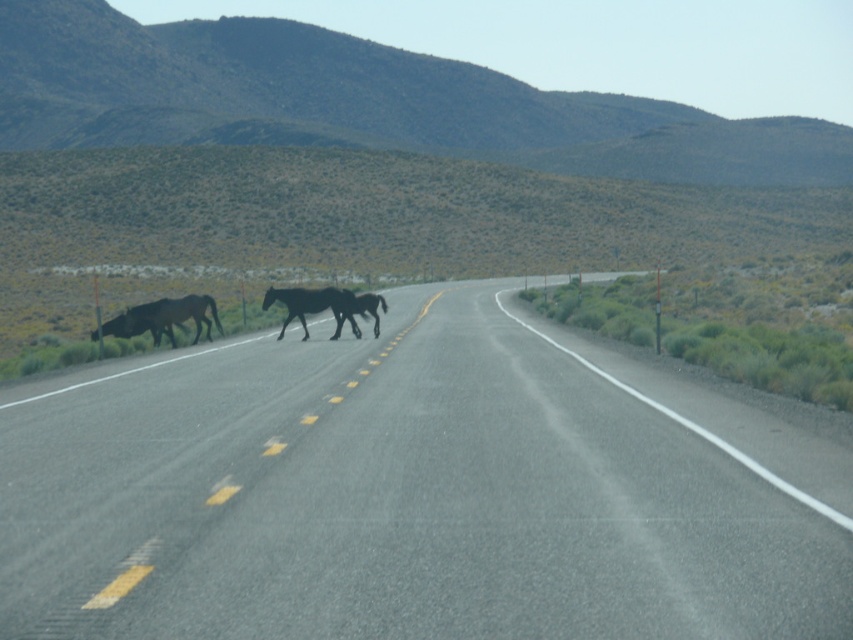
What do you see at coordinates (415, 492) in the screenshot? The image size is (853, 640). I see `black asphalt highway at center` at bounding box center [415, 492].

Between black asphalt highway at center and dark brown horse at center, which one has less height?

dark brown horse at center is shorter.

The image size is (853, 640). Describe the element at coordinates (415, 492) in the screenshot. I see `black asphalt highway at center` at that location.

You are a GUI agent. You are given a task and a screenshot of the screen. Output one action in this format:
    pyautogui.click(x=<x>, y=<y>)
    Task: Click on the black asphalt highway at center
    
    Given the screenshot: What is the action you would take?
    pyautogui.click(x=415, y=492)

Does point (312, 298) come in front of point (372, 305)?

Yes, point (312, 298) is closer to viewer.

Between black glossy horse at center and dark brown glossy horse at center, which one has more height?

Standing taller between the two is black glossy horse at center.

Does point (316, 296) come behind point (331, 339)?

That is False.

You are a GUI agent. You are given a task and a screenshot of the screen. Output one action in this format:
    pyautogui.click(x=<x>, y=<y>)
    Task: Click on the black glossy horse at center
    The height and width of the screenshot is (640, 853).
    Given the screenshot: What is the action you would take?
    pyautogui.click(x=312, y=307)

Consider the image. Who is taller, black asphalt highway at center or black glossy horse at center?

Standing taller between the two is black glossy horse at center.

This screenshot has height=640, width=853. What do you see at coordinates (415, 492) in the screenshot?
I see `black asphalt highway at center` at bounding box center [415, 492].

Locate an element on the screen. This screenshot has height=640, width=853. black asphalt highway at center is located at coordinates (415, 492).